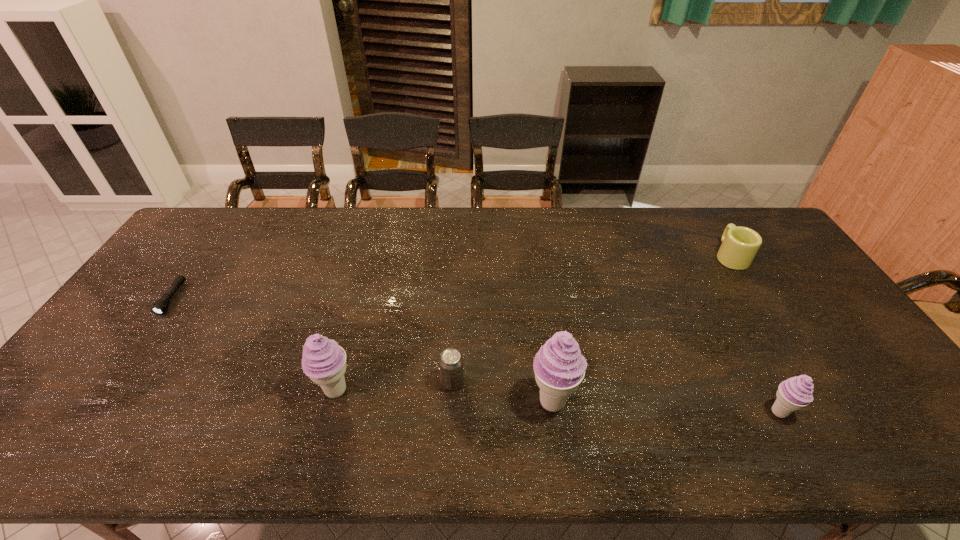
The height and width of the screenshot is (540, 960). I want to click on the closest icecream to the shortest object, so pyautogui.click(x=323, y=360).

The height and width of the screenshot is (540, 960). Find the location of `vacant space that satisfies the following two spatial constraints: 1. at the lens end of the fifth object from left to right; 2. on the right side of the shortest object`. vacant space that satisfies the following two spatial constraints: 1. at the lens end of the fifth object from left to right; 2. on the right side of the shortest object is located at coordinates (91, 412).